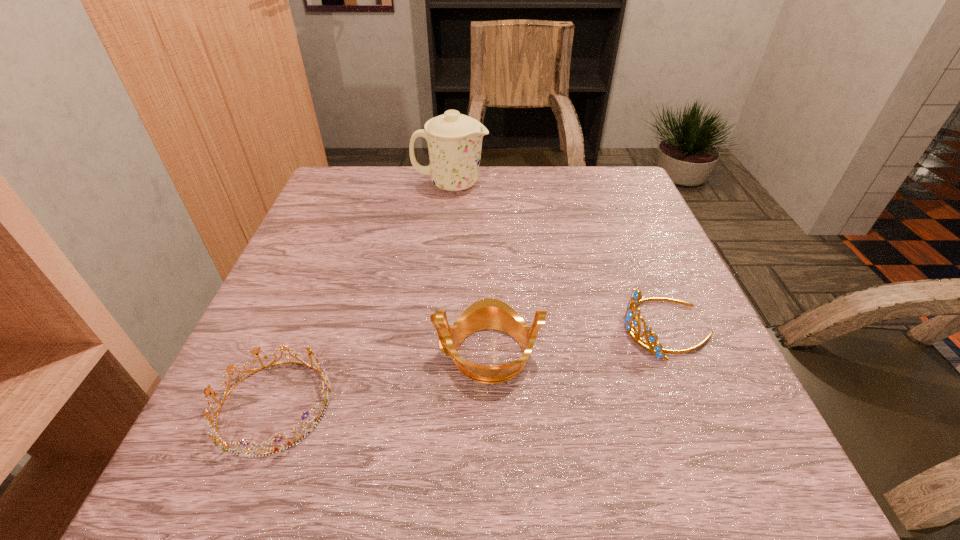
At what (x,y) coordinates should I click in order to perform the action: click on free area in between the second tiara from right to left and the leftmost tiara. Please return your answer as a coordinate pair (x, y). This screenshot has height=540, width=960. Looking at the image, I should click on (381, 379).

Identify the location of free space between the second tiara from left to right and the farthest object. (469, 269).

The width and height of the screenshot is (960, 540). Identify the location of vacant area between the second tiara from right to left and the chinaware. (469, 269).

Identify the location of vacant region between the rightmost object and the second tiara from left to right. Image resolution: width=960 pixels, height=540 pixels. (577, 341).

Where is `free area in between the shortest tiara and the second tiara from left to right`? The height and width of the screenshot is (540, 960). free area in between the shortest tiara and the second tiara from left to right is located at coordinates (381, 379).

Identify which object is located as the nearest to the rightmost object. Please provide its 2D coordinates. Your answer should be formatted as a tuple, i.e. [(x, y)], where the tuple contains the x and y coordinates of a point satisfying the conditions above.

[(489, 313)]

I want to click on object that is the second nearest to the rightmost object, so click(x=454, y=140).

The image size is (960, 540). I want to click on tiara that is the closest to the rightmost object, so click(489, 313).

Identify which tiara is located as the nearest to the second tiara from right to left. Please provide its 2D coordinates. Your answer should be formatted as a tuple, i.e. [(x, y)], where the tuple contains the x and y coordinates of a point satisfying the conditions above.

[(218, 441)]